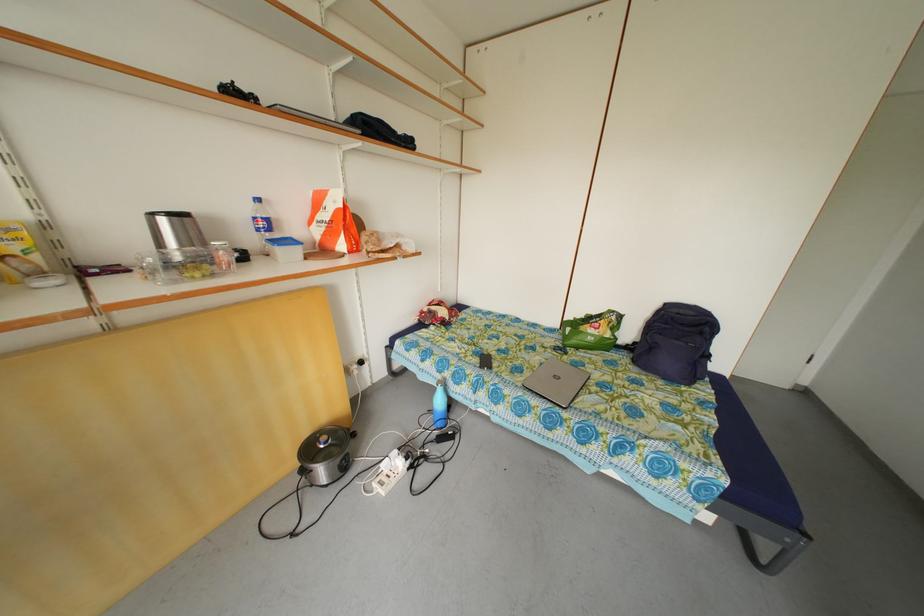
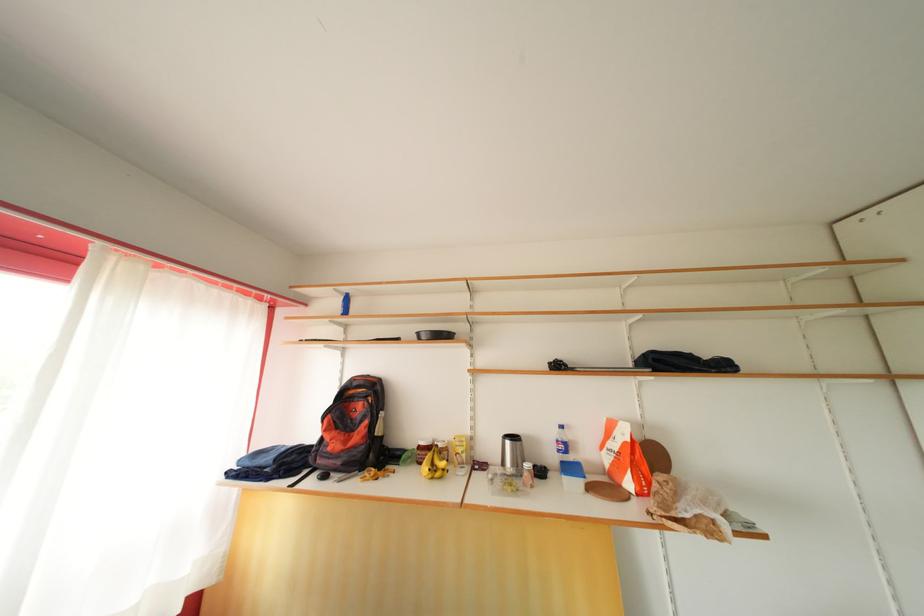
The point at (305, 256) is marked in the first image. Where is the corresponding point in the second image?

(587, 488)